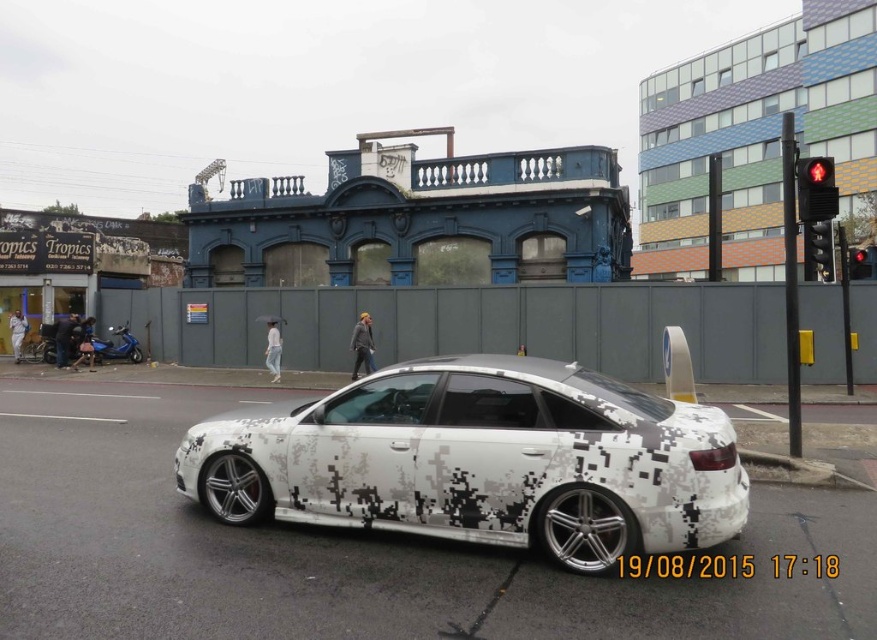
Between point (818, 202) and point (868, 260), which one is positioned in front?

Point (818, 202) is in front.

Can you confirm if red plastic pedestrian signal at upper right is positioned below red plastic traffic light at upper right?

Incorrect, red plastic pedestrian signal at upper right is not positioned below red plastic traffic light at upper right.

Is point (817, 202) closer to camera compared to point (865, 248)?

Yes, it is in front of point (865, 248).

This screenshot has height=640, width=877. What are the coordinates of `red plastic pedestrian signal at upper right` in the screenshot? It's located at (816, 188).

Who is more distant from viewer, (646, 456) or (868, 259)?

Positioned behind is point (868, 259).

Between white camouflage car at center and red plastic traffic light at upper right, which one is positioned higher?

Positioned higher is red plastic traffic light at upper right.

Identify the location of white camouflage car at center. (481, 460).

Is metallic black traffic light at right taller than red plastic traffic light at upper right?

Incorrect, metallic black traffic light at right's height is not larger of red plastic traffic light at upper right's.

The width and height of the screenshot is (877, 640). What do you see at coordinates (818, 252) in the screenshot?
I see `metallic black traffic light at right` at bounding box center [818, 252].

Which is behind, point (808, 236) or point (873, 264)?

Point (873, 264)

I want to click on metallic black traffic light at right, so click(818, 252).